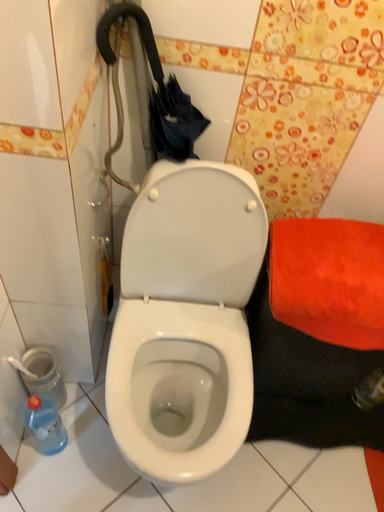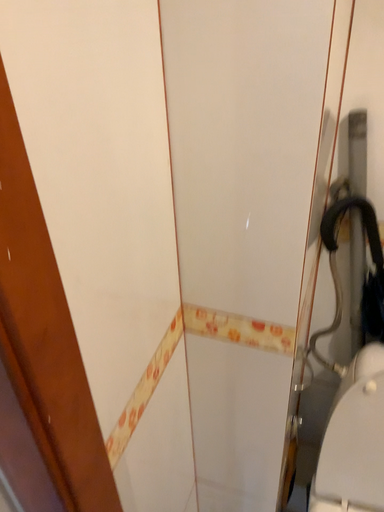
Question: Which way did the camera rotate in the video?

Choices:
 (A) rotated left
 (B) rotated right

Answer: (A)